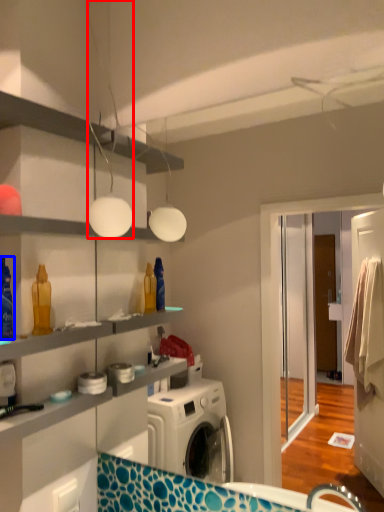
Question: Which of the following is the closest to the observer, light fixture (highlighted by a red box) or cleaning product (highlighted by a blue box)?

Choices:
 (A) light fixture
 (B) cleaning product

Answer: (B)